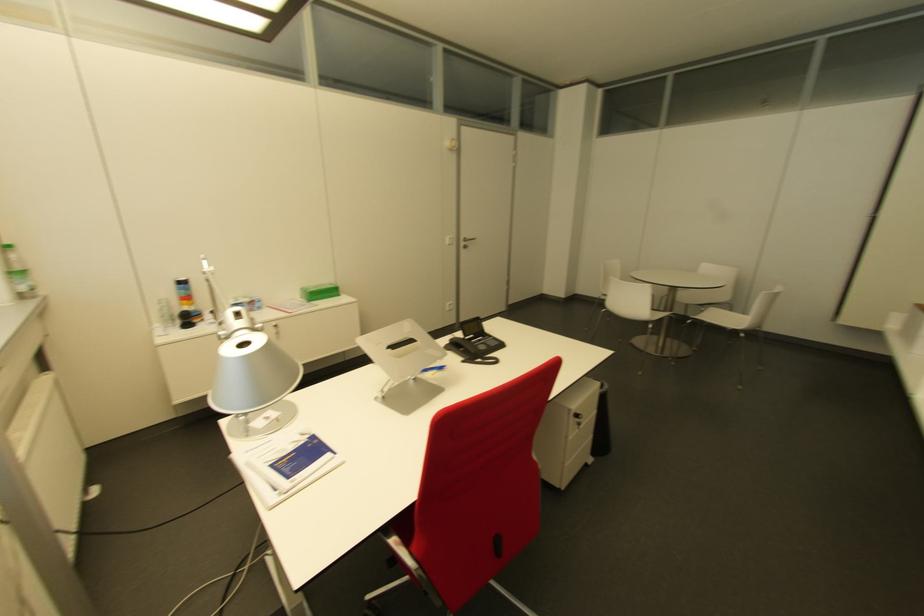
Identify the location of cabinet lock. This screenshot has width=924, height=616. (580, 418).